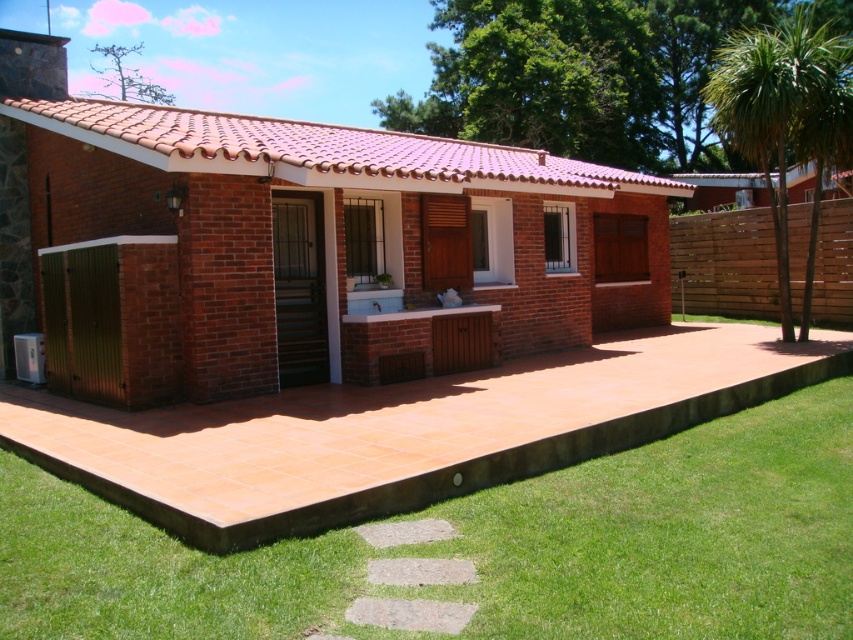
You are standing at the entrance of the house and want to reach the terracotta tile terrace at center. According to the coordinates provided, in which direction should you move relative to your current position?

The terracotta tile terrace at center is located at point (316, 252), which means it is positioned to the right and slightly forward from your current position at the entrance. You should move diagonally towards the right and forward to reach it.

You are planning to install a new garden sprinkler system. The system can cover an area up to the size of the green leafy palm tree at right. Will the green grass at lower left be fully watered by this system?

The green grass at lower left is smaller than the green leafy palm tree at right, so the sprinkler system designed to cover the palm tree size can fully water the green grass at lower left.